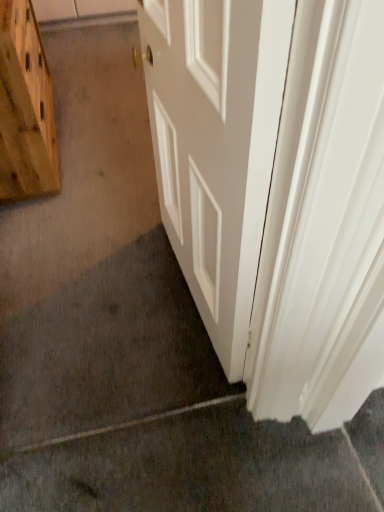
Describe the element at coordinates (202, 464) in the screenshot. I see `gray carpet at lower left` at that location.

What is the approximate width of wooden cutting board at left?

It is 14.48 inches.

The height and width of the screenshot is (512, 384). I want to click on gray carpet at lower left, so click(202, 464).

From the picture: Is there a large distance between wooden cutting board at left and gray carpet at lower left?

Indeed, wooden cutting board at left is not near gray carpet at lower left.

Is wooden cutting board at left wider than gray carpet at lower left?

No, wooden cutting board at left is not wider than gray carpet at lower left.

Is wooden cutting board at left facing away from gray carpet at lower left?

No.

From the image's perspective, who appears lower, wooden cutting board at left or gray carpet at lower left?

gray carpet at lower left, from the image's perspective.

Does point (31, 38) lie behind point (342, 366)?

That is True.

Would you consider wooden cutting board at left to be distant from white smooth door at center?

wooden cutting board at left is positioned a significant distance from white smooth door at center.

Who is more distant, wooden cutting board at left or white smooth door at center?

wooden cutting board at left is further from the camera.

Does wooden cutting board at left have a greater width compared to white smooth door at center?

No, wooden cutting board at left is not wider than white smooth door at center.

Could you tell me if white smooth door at center is turned towards wooden cutting board at left?

No, white smooth door at center is not turned towards wooden cutting board at left.

Considering the positions of points (283, 278) and (2, 129), is point (283, 278) closer to camera compared to point (2, 129)?

Yes, point (283, 278) is in front of point (2, 129).

Considering the relative sizes of white smooth door at center and wooden cutting board at left in the image provided, is white smooth door at center shorter than wooden cutting board at left?

No.

From the image's perspective, does white smooth door at center appear lower than wooden cutting board at left?

Correct, white smooth door at center appears lower than wooden cutting board at left in the image.

From the picture: From the image's perspective, which object appears higher, white smooth door at center or gray carpet at lower left?

white smooth door at center is shown above in the image.

Considering the sizes of objects white smooth door at center and gray carpet at lower left in the image provided, who is bigger, white smooth door at center or gray carpet at lower left?

white smooth door at center.

Measure the distance between white smooth door at center and gray carpet at lower left.

20.29 inches.

Which object is closer to the camera, white smooth door at center or gray carpet at lower left?

Positioned in front is white smooth door at center.

The height and width of the screenshot is (512, 384). Identify the location of concrete lying on the right of wooden cutting board at left. (202, 464).

Is gray carpet at lower left directly adjacent to wooden cutting board at left?

No, gray carpet at lower left is not touching wooden cutting board at left.

Does gray carpet at lower left appear on the left side of wooden cutting board at left?

In fact, gray carpet at lower left is to the right of wooden cutting board at left.

Who is shorter, gray carpet at lower left or wooden cutting board at left?

gray carpet at lower left.

Can you tell me how much gray carpet at lower left and white smooth door at center differ in facing direction?

The angular difference between gray carpet at lower left and white smooth door at center is 83.2 degrees.

Based on the photo, relative to white smooth door at center, is gray carpet at lower left in front or behind?

gray carpet at lower left is positioned farther from the viewer than white smooth door at center.

Is gray carpet at lower left thinner than white smooth door at center?

Incorrect, the width of gray carpet at lower left is not less than that of white smooth door at center.

Considering the relative sizes of gray carpet at lower left and white smooth door at center in the image provided, is gray carpet at lower left bigger than white smooth door at center?

No, gray carpet at lower left is not bigger than white smooth door at center.

In order to click on cabinetry located above the gray carpet at lower left (from the image's perspective) in this screenshot , I will do `click(25, 108)`.

This screenshot has height=512, width=384. What are the coordinates of `door positioned vertically above the wooden cutting board at left (from a real-world perspective)` in the screenshot? It's located at (276, 190).

Estimate the real-world distances between objects in this image. Which object is further from gray carpet at lower left, white smooth door at center or wooden cutting board at left?

wooden cutting board at left lies further to gray carpet at lower left than the other object.

When comparing their distances from white smooth door at center, does wooden cutting board at left or gray carpet at lower left seem closer?

gray carpet at lower left.

When comparing their distances from white smooth door at center, does gray carpet at lower left or wooden cutting board at left seem further?

The object further to white smooth door at center is wooden cutting board at left.

Which object lies further to the anchor point gray carpet at lower left, wooden cutting board at left or white smooth door at center?

The object further to gray carpet at lower left is wooden cutting board at left.

Based on their spatial positions, is white smooth door at center or gray carpet at lower left further from wooden cutting board at left?

gray carpet at lower left.

From the image, which object appears to be nearer to wooden cutting board at left, gray carpet at lower left or white smooth door at center?

white smooth door at center.

Where is `door between wooden cutting board at left and gray carpet at lower left in the up-down direction`? door between wooden cutting board at left and gray carpet at lower left in the up-down direction is located at coordinates (276, 190).